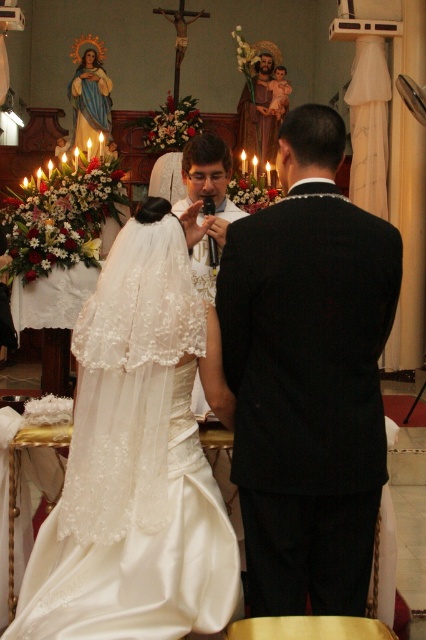
Who is higher up, black wool suit at center or satin/embroidered dress at center?

black wool suit at center is higher up.

Is black wool suit at center positioned at the back of satin/embroidered dress at center?

Yes, black wool suit at center is further from the viewer.

Find the location of a particular element. Image resolution: width=426 pixels, height=640 pixels. black wool suit at center is located at coordinates (307, 376).

Is matte black vest at center positioned in front of matte white veil at upper left?

Yes, it is.

Does matte black vest at center have a lesser height compared to matte white veil at upper left?

Indeed, matte black vest at center has a lesser height compared to matte white veil at upper left.

Is point (201, 388) less distant than point (97, 102)?

Yes, it is in front of point (97, 102).

Find the location of a particular element. This screenshot has width=426, height=640. matte black vest at center is located at coordinates (207, 198).

Between satin/embroidered dress at center and matte white veil at upper left, which one is positioned higher?

Positioned higher is matte white veil at upper left.

Who is more distant from viewer, (143, 461) or (86, 96)?

Positioned behind is point (86, 96).

The height and width of the screenshot is (640, 426). In order to click on satin/embroidered dress at center in this screenshot , I will do `click(138, 458)`.